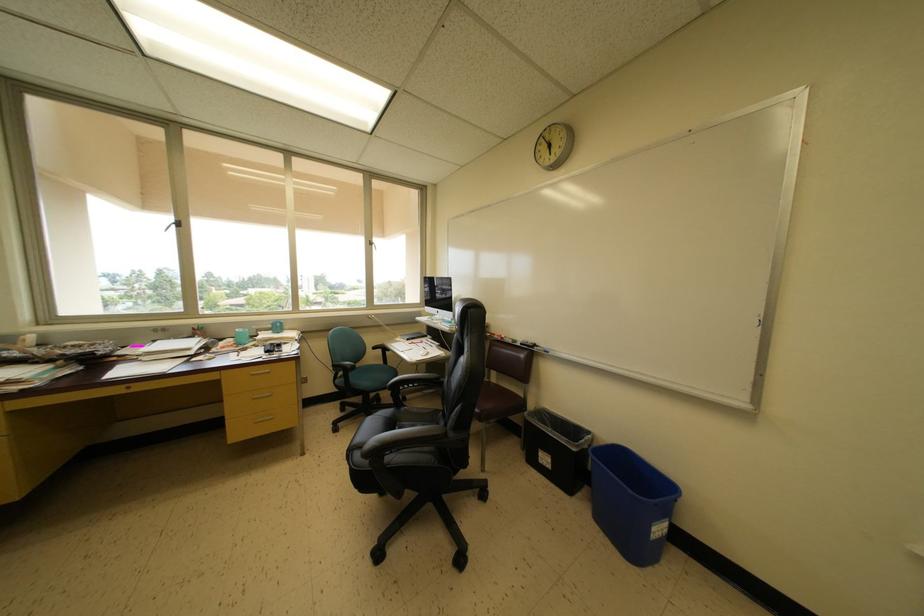
Where would you turn the window handle? Please return your answer as a coordinate pair (x, y).

(174, 225)